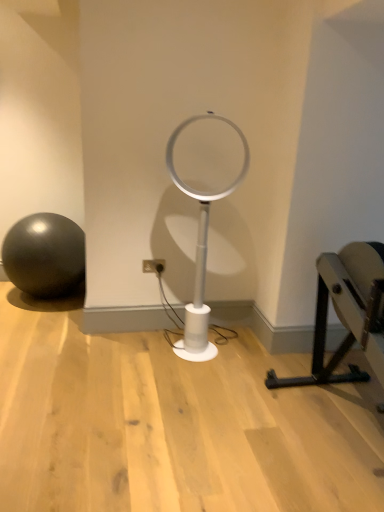
Question: Is white plastic table lamp at center taller than white plastic electric outlet at center?

Choices:
 (A) yes
 (B) no

Answer: (A)

Question: Can you confirm if white plastic table lamp at center is shorter than white plastic electric outlet at center?

Choices:
 (A) yes
 (B) no

Answer: (B)

Question: Could you tell me if white plastic table lamp at center is turned towards white plastic electric outlet at center?

Choices:
 (A) yes
 (B) no

Answer: (B)

Question: Can you see white plastic table lamp at center touching white plastic electric outlet at center?

Choices:
 (A) yes
 (B) no

Answer: (B)

Question: From a real-world perspective, is white plastic table lamp at center under white plastic electric outlet at center?

Choices:
 (A) yes
 (B) no

Answer: (B)

Question: In the image, is white plastic electric outlet at center on the left side or the right side of black metal bench at right?

Choices:
 (A) right
 (B) left

Answer: (B)

Question: In terms of size, does white plastic electric outlet at center appear bigger or smaller than black metal bench at right?

Choices:
 (A) big
 (B) small

Answer: (B)

Question: Is point pyautogui.click(x=160, y=271) closer or farther from the camera than point pyautogui.click(x=377, y=374)?

Choices:
 (A) farther
 (B) closer

Answer: (A)

Question: From their relative heights in the image, would you say white plastic electric outlet at center is taller or shorter than black metal bench at right?

Choices:
 (A) tall
 (B) short

Answer: (B)

Question: Considering the positions of point (246, 144) and point (264, 379), is point (246, 144) closer or farther from the camera than point (264, 379)?

Choices:
 (A) closer
 (B) farther

Answer: (B)

Question: Would you say white plastic table lamp at center is to the left or to the right of black metal bench at right in the picture?

Choices:
 (A) right
 (B) left

Answer: (B)

Question: Is white plastic table lamp at center situated inside black metal bench at right or outside?

Choices:
 (A) outside
 (B) inside

Answer: (A)

Question: Is white plastic table lamp at center taller or shorter than black metal bench at right?

Choices:
 (A) tall
 (B) short

Answer: (A)

Question: Is black metal bench at right spatially inside matte black ball at left, or outside of it?

Choices:
 (A) inside
 (B) outside

Answer: (B)

Question: From the image's perspective, is black metal bench at right positioned above or below matte black ball at left?

Choices:
 (A) below
 (B) above

Answer: (A)